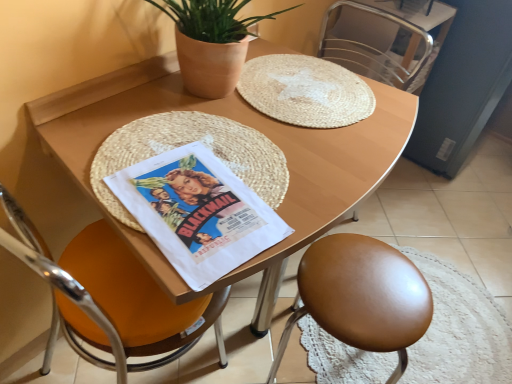
What are the coordinates of `vacant space situated above white paper comic book at center (from a real-world perspective)` in the screenshot? It's located at (202, 205).